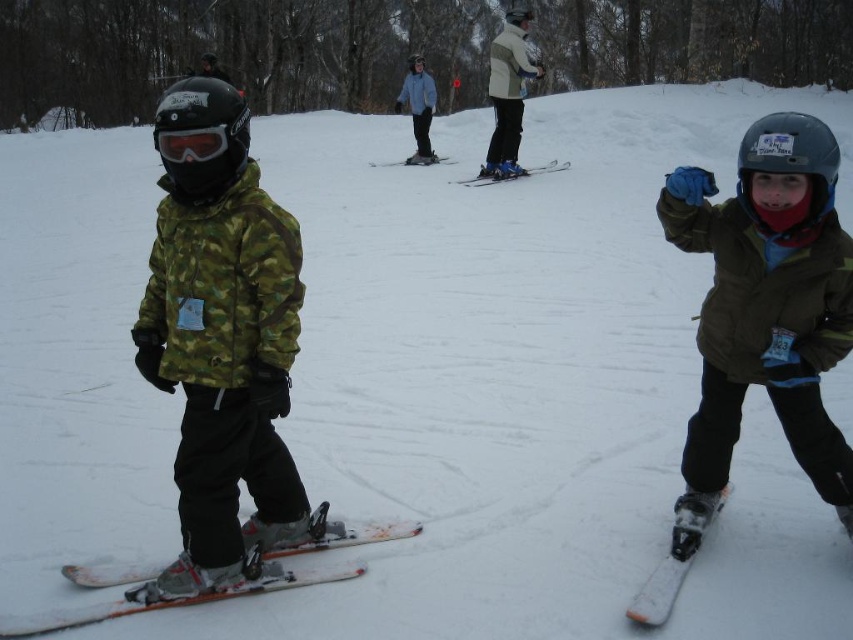
Between orange metallic skis at left and light blue fabric jacket at center, which one is positioned higher?

light blue fabric jacket at center is above.

Does orange metallic skis at left have a smaller size compared to light blue fabric jacket at center?

Correct, orange metallic skis at left occupies less space than light blue fabric jacket at center.

Does point (125, 602) come in front of point (405, 81)?

Yes, it is in front of point (405, 81).

I want to click on orange metallic skis at left, so click(231, 584).

Which of these two, camouflage fabric jacket at left or orange metallic skis at left, stands shorter?

orange metallic skis at left is shorter.

Where is `camouflage fabric jacket at left`? This screenshot has width=853, height=640. camouflage fabric jacket at left is located at coordinates (221, 340).

Can you confirm if beige jacket at center is shorter than white plastic skis at center?

No, beige jacket at center is not shorter than white plastic skis at center.

Is point (515, 28) farther from viewer compared to point (431, 163)?

That is False.

What do you see at coordinates (508, 93) in the screenshot? The image size is (853, 640). I see `beige jacket at center` at bounding box center [508, 93].

This screenshot has width=853, height=640. Identify the location of beige jacket at center. (508, 93).